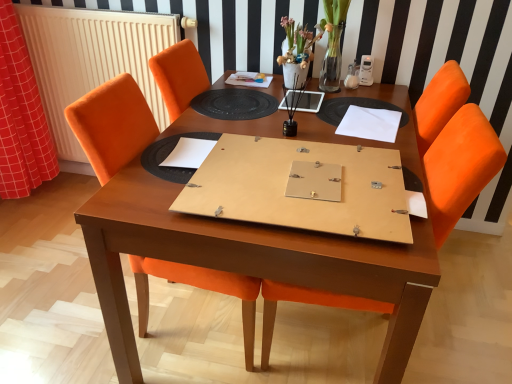
Question: Is orange fabric chair at center, which is the first chair in right-to-left order, positioned behind red checkered fabric at left?

Choices:
 (A) no
 (B) yes

Answer: (A)

Question: Is red checkered fabric at left a part of orange fabric chair at center, which appears as the 2th chair when viewed from the left?

Choices:
 (A) yes
 (B) no

Answer: (B)

Question: From the image's perspective, is orange fabric chair at center, which is the first chair in right-to-left order, on top of red checkered fabric at left?

Choices:
 (A) yes
 (B) no

Answer: (B)

Question: From a real-world perspective, is orange fabric chair at center, which appears as the 2th chair when viewed from the left, positioned over red checkered fabric at left based on gravity?

Choices:
 (A) yes
 (B) no

Answer: (B)

Question: From a real-world perspective, does orange fabric chair at center, which is the first chair in right-to-left order, sit lower than red checkered fabric at left?

Choices:
 (A) yes
 (B) no

Answer: (A)

Question: In terms of width, does orange fabric chair at center, which is the first chair in right-to-left order, look wider or thinner when compared to white paper at center, which appears as the 2th notebook when viewed from the right?

Choices:
 (A) wide
 (B) thin

Answer: (A)

Question: Considering the relative positions of orange fabric chair at center, which is the first chair in right-to-left order, and white paper at center, placed as the 1th notebook when sorted from bottom to top, in the image provided, is orange fabric chair at center, which is the first chair in right-to-left order, to the left or to the right of white paper at center, placed as the 1th notebook when sorted from bottom to top,?

Choices:
 (A) left
 (B) right

Answer: (B)

Question: Is point (451, 140) positioned closer to the camera than point (214, 140)?

Choices:
 (A) farther
 (B) closer

Answer: (B)

Question: From the image's perspective, is orange fabric chair at center, which is the first chair in right-to-left order, positioned above or below white paper at center, placed as the 1th notebook when sorted from bottom to top?

Choices:
 (A) above
 (B) below

Answer: (B)

Question: From the image's perspective, relative to orange fabric chair at center, which appears as the 2th chair when viewed from the left, is wooden table at center above or below?

Choices:
 (A) below
 (B) above

Answer: (B)

Question: In terms of width, does wooden table at center look wider or thinner when compared to orange fabric chair at center, which is the first chair in right-to-left order?

Choices:
 (A) thin
 (B) wide

Answer: (B)

Question: Considering their positions, is wooden table at center located in front of or behind orange fabric chair at center, which appears as the 2th chair when viewed from the left?

Choices:
 (A) front
 (B) behind

Answer: (A)

Question: From a real-world perspective, is wooden table at center positioned above or below orange fabric chair at center, which is the first chair in right-to-left order?

Choices:
 (A) below
 (B) above

Answer: (A)

Question: Looking at their shapes, would you say white paper at upper right, the 2th notebook when ordered from left to right, is wider or thinner than black rubber placemat at center?

Choices:
 (A) thin
 (B) wide

Answer: (A)

Question: Considering the positions of white paper at upper right, positioned as the 2th notebook in bottom-to-top order, and black rubber placemat at center in the image, is white paper at upper right, positioned as the 2th notebook in bottom-to-top order, taller or shorter than black rubber placemat at center?

Choices:
 (A) short
 (B) tall

Answer: (B)